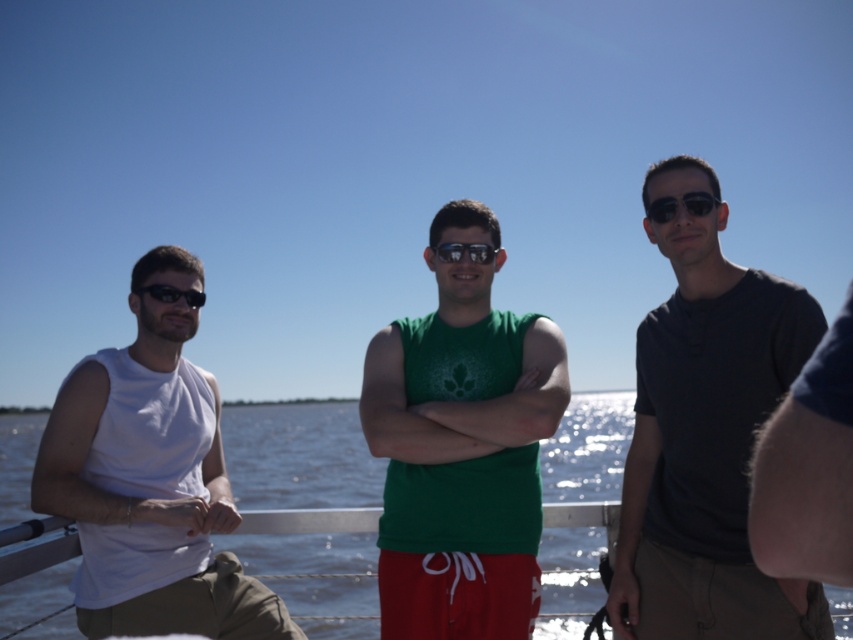
Who is positioned more to the left, matte black goggles at center or matte black sunglasses at left?

Positioned to the left is matte black sunglasses at left.

Who is more forward, (457,257) or (171,296)?

Point (457,257) is in front.

Which is in front, point (461, 256) or point (140, 296)?

Point (461, 256) is more forward.

Image resolution: width=853 pixels, height=640 pixels. Find the location of `matte black goggles at center`. matte black goggles at center is located at coordinates pos(463,252).

Is matte black t-shirt at right shorter than white matte tank top at left?

In fact, matte black t-shirt at right may be taller than white matte tank top at left.

Can you confirm if matte black t-shirt at right is wider than white matte tank top at left?

No, matte black t-shirt at right is not wider than white matte tank top at left.

At what (x,y) coordinates should I click in order to perform the action: click on matte black t-shirt at right. Please return your answer as a coordinate pair (x, y). The width and height of the screenshot is (853, 640). Looking at the image, I should click on (706, 435).

The width and height of the screenshot is (853, 640). In order to click on matte black t-shirt at right in this screenshot , I will do `click(706, 435)`.

Is green matte tank top at center bigger than white matte tank top at left?

Incorrect, green matte tank top at center is not larger than white matte tank top at left.

Between green matte tank top at center and white matte tank top at left, which one has less height?

green matte tank top at center is shorter.

The height and width of the screenshot is (640, 853). What are the coordinates of `green matte tank top at center` in the screenshot? It's located at (461, 449).

Image resolution: width=853 pixels, height=640 pixels. What are the coordinates of `green matte tank top at center` in the screenshot? It's located at tap(461, 449).